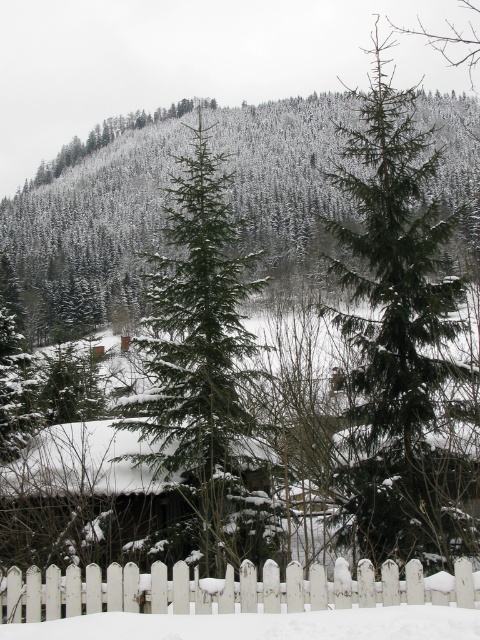
Can you confirm if green matte evergreen tree at center is taller than white wooden picket fence at lower center?

Yes.

Does green matte evergreen tree at center appear on the left side of white wooden picket fence at lower center?

Correct, you'll find green matte evergreen tree at center to the left of white wooden picket fence at lower center.

Does point (159, 275) come in front of point (371, 570)?

That is False.

Locate an element on the screen. The image size is (480, 640). green matte evergreen tree at center is located at coordinates (202, 365).

Is point (467, 100) positioned after point (155, 280)?

Yes.

Can you confirm if snow-covered evergreen trees at upper center is shorter than green matte evergreen tree at center?

In fact, snow-covered evergreen trees at upper center may be taller than green matte evergreen tree at center.

Find the location of a particular element. Image resolution: width=480 pixels, height=640 pixels. snow-covered evergreen trees at upper center is located at coordinates (92, 228).

Between green needle-like tree at center and green matte evergreen tree at center, which one has less height?

green matte evergreen tree at center is shorter.

Is point (425, 147) positioned in front of point (187, 381)?

That is False.

Between point (368, 224) and point (151, 403), which one is positioned in front?

Positioned in front is point (151, 403).

At what (x,y) coordinates should I click in order to perform the action: click on green needle-like tree at center. Please return your answer as a coordinate pair (x, y). The image size is (480, 640). Looking at the image, I should click on (396, 337).